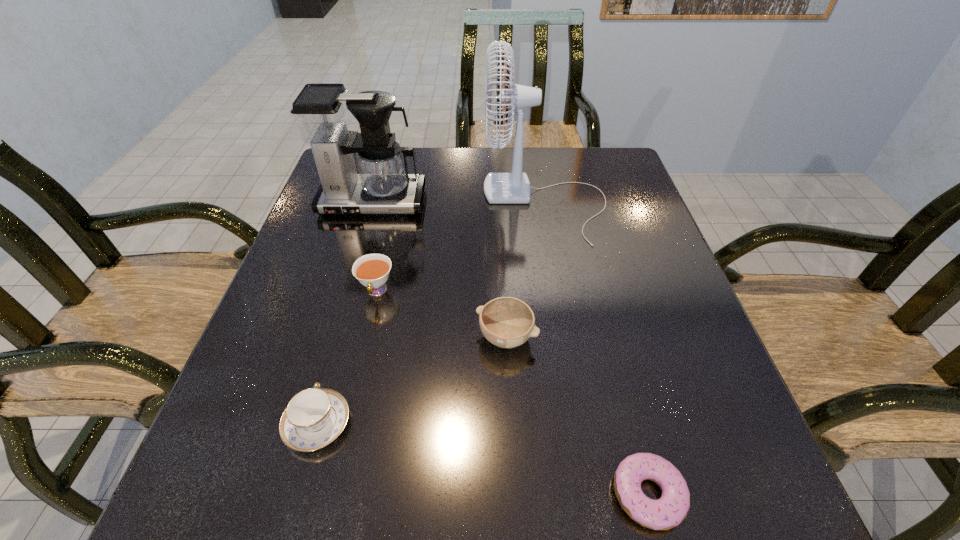
This screenshot has width=960, height=540. Find the location of `blank space located on the front-facing side of the fan`. blank space located on the front-facing side of the fan is located at coordinates (433, 204).

I want to click on free space located 0.240m on the front-facing side of the fan, so click(390, 204).

This screenshot has height=540, width=960. What are the coordinates of `vacant space located 0.150m at the front of the second tallest object where the controls are located` in the screenshot? It's located at (354, 262).

Locate an element on the screen. The height and width of the screenshot is (540, 960). blank area located 0.270m on the side of the fourth nearest object with the handle is located at coordinates (344, 437).

Locate an element on the screen. vacant area located 0.340m on the back of the fourth farthest object is located at coordinates (500, 212).

This screenshot has height=540, width=960. What are the coordinates of `free point located on the side with the handle of the nearer teacup` in the screenshot? It's located at (361, 267).

Locate an element on the screen. vacant region located on the side with the handle of the nearer teacup is located at coordinates (349, 309).

At what (x,y) coordinates should I click in order to perform the action: click on vacant region located on the side with the handle of the nearer teacup. Please return your answer as a coordinate pair (x, y). Looking at the image, I should click on (364, 255).

Where is `free space located 0.380m on the left of the nearest object`? The image size is (960, 540). free space located 0.380m on the left of the nearest object is located at coordinates (348, 494).

In order to click on fan present at the far edge in this screenshot , I will do 513,187.